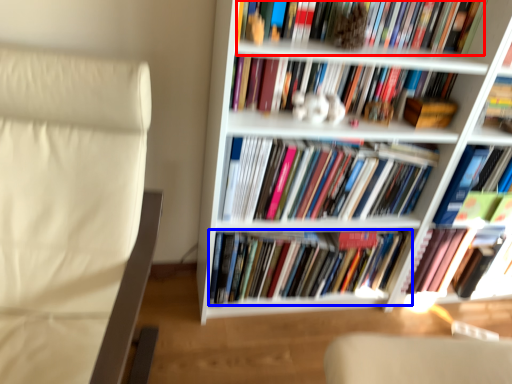
Question: Which point is further to the camera, book (highlighted by a red box) or book (highlighted by a blue box)?

Choices:
 (A) book
 (B) book

Answer: (B)